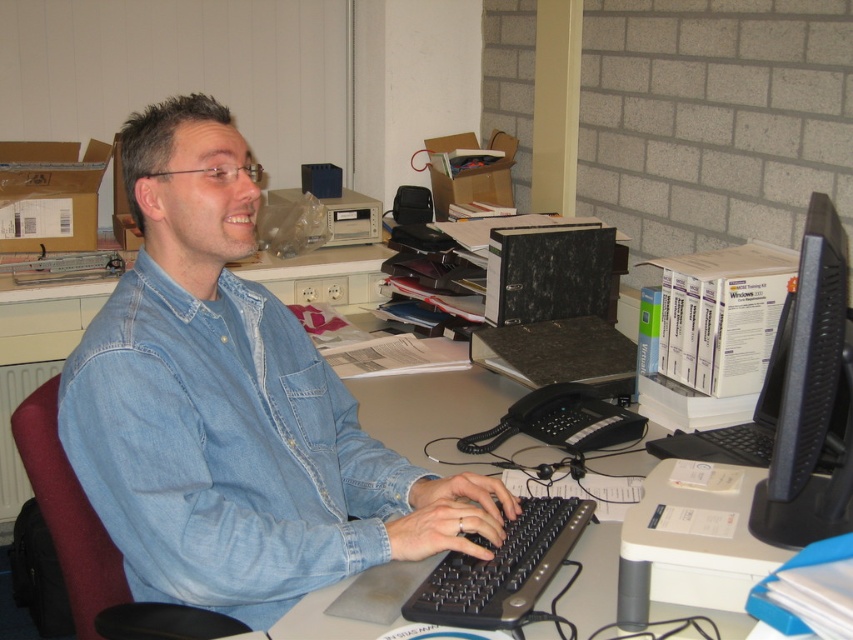
From the picture: Can you confirm if black plastic monitor at right is taller than black plastic keyboard at center?

Indeed, black plastic monitor at right has a greater height compared to black plastic keyboard at center.

Does black plastic monitor at right appear under black plastic keyboard at center?

No, black plastic monitor at right is not below black plastic keyboard at center.

The width and height of the screenshot is (853, 640). Describe the element at coordinates (810, 397) in the screenshot. I see `black plastic monitor at right` at that location.

Find the location of a particular element. This screenshot has height=640, width=853. black plastic monitor at right is located at coordinates (810, 397).

Can you confirm if denim shirt at center is positioned above black plastic monitor at right?

Yes, denim shirt at center is above black plastic monitor at right.

Does point (112, 433) come in front of point (837, 500)?

No, (112, 433) is behind (837, 500).

Identify the location of denim shirt at center. (233, 406).

Between point (299, 330) and point (485, 566), which one is positioned in front?

Positioned in front is point (485, 566).

Which of these two, denim shirt at center or black plastic keyboard at center, stands shorter?

black plastic keyboard at center

Is point (93, 490) farther from viewer compared to point (442, 579)?

Yes, point (93, 490) is farther from viewer.

Where is `denim shirt at center`? This screenshot has width=853, height=640. denim shirt at center is located at coordinates (233, 406).